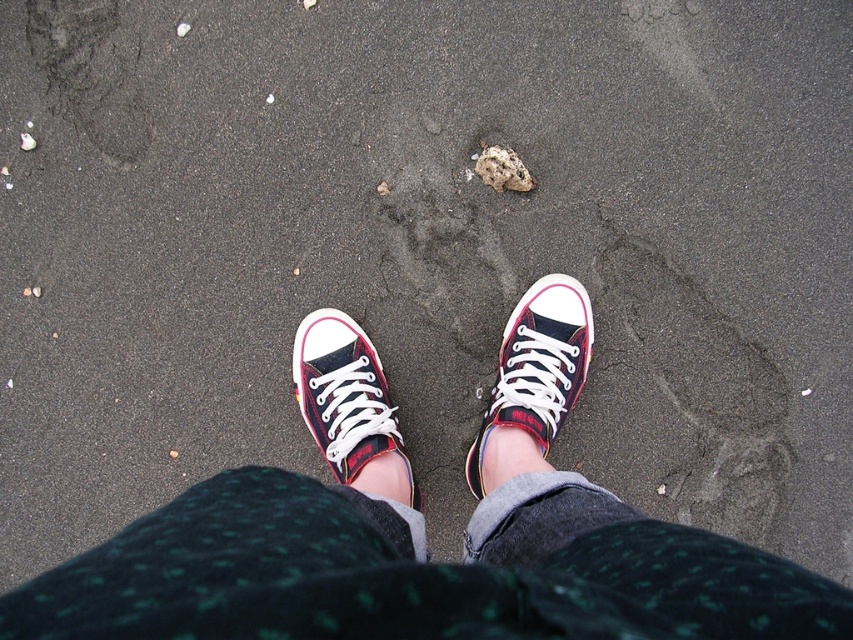
Who is lower down, matte canvas sneakers at center or plaid canvas shoe at center?

matte canvas sneakers at center is lower down.

Can you confirm if matte canvas sneakers at center is positioned below plaid canvas shoe at center?

Correct, matte canvas sneakers at center is located below plaid canvas shoe at center.

Find the location of a particular element. The image size is (853, 640). matte canvas sneakers at center is located at coordinates (424, 529).

Can you confirm if matte canvas sneakers at center is thinner than matte canvas sneaker at center?

No.

The width and height of the screenshot is (853, 640). Describe the element at coordinates (424, 529) in the screenshot. I see `matte canvas sneakers at center` at that location.

Locate an element on the screen. The width and height of the screenshot is (853, 640). matte canvas sneakers at center is located at coordinates (424, 529).

Is plaid canvas shoe at center below matte canvas sneaker at center?

Incorrect, plaid canvas shoe at center is not positioned below matte canvas sneaker at center.

Is point (531, 410) less distant than point (358, 404)?

Yes, point (531, 410) is closer to viewer.

Find the location of a particular element. plaid canvas shoe at center is located at coordinates (537, 365).